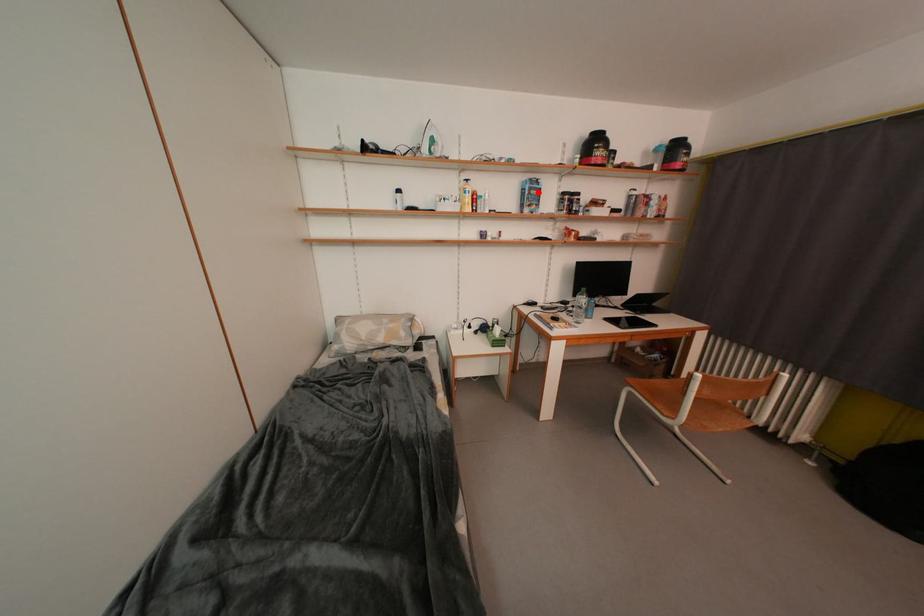
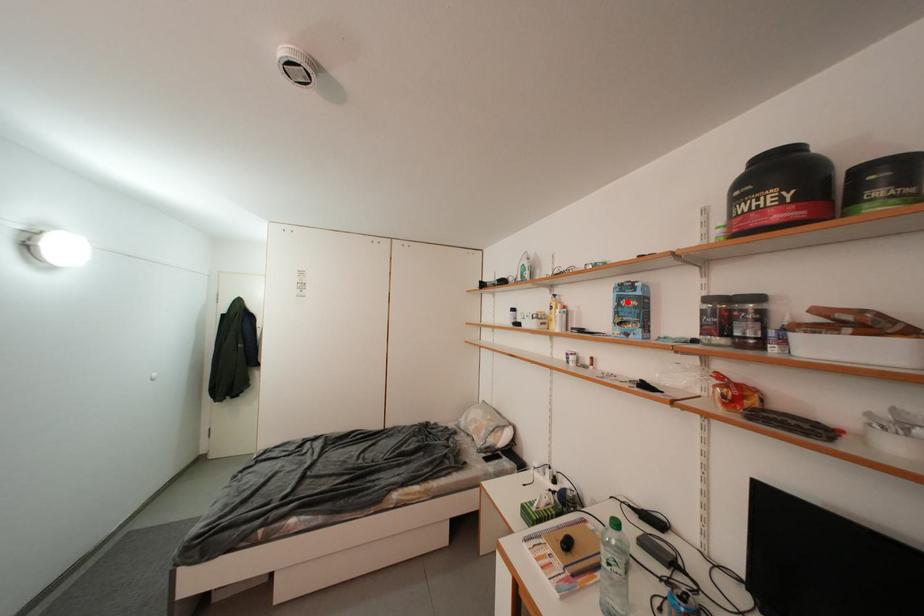
I am providing you with two images of the same scene from different viewpoints. A red point is marked on the first image and another point is marked on the second image. Is the marked point in image1 the same physical position as the marked point in image2?

Yes